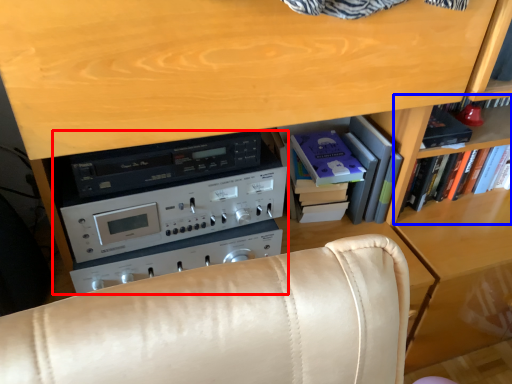
Question: Which object is further to the camera taking this photo, appliance (highlighted by a red box) or shelf (highlighted by a blue box)?

Choices:
 (A) appliance
 (B) shelf

Answer: (B)